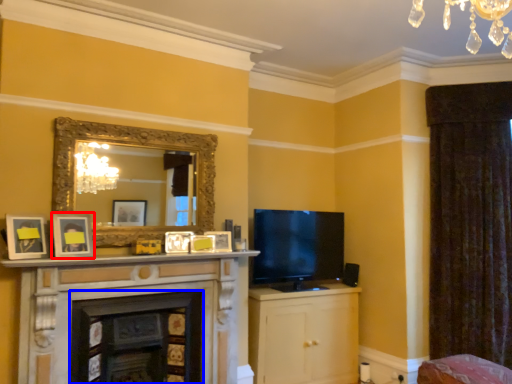
Question: Which object appears farthest to the camera in this image, picture frame (highlighted by a red box) or fireplace (highlighted by a blue box)?

Choices:
 (A) picture frame
 (B) fireplace

Answer: (B)